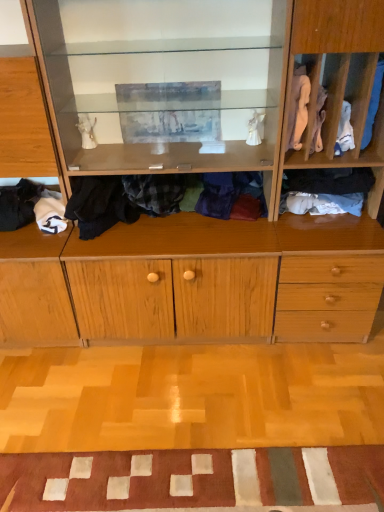
Locate an element on the screen. The image size is (384, 512). free space above patchwork fabric doormat at lower center (from a real-world perspective) is located at coordinates (196, 475).